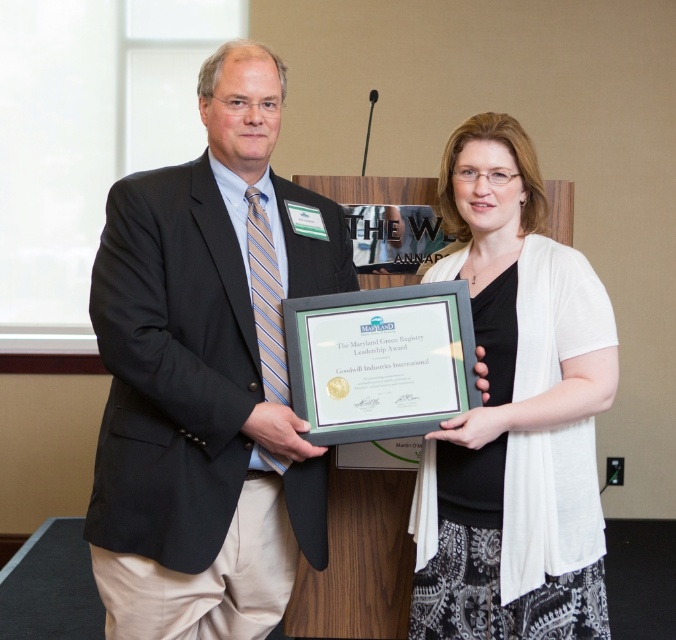
You are a photographer setting up for a group photo. You notice the matte black suit at center and the white textured cardigan at center. Which clothing item takes up more horizontal space in the frame?

The matte black suit at center takes up more horizontal space than the white textured cardigan at center because its width surpasses the cardigan.

You are a photographer standing 6 feet away from the matte black suit at center. You want to take a photo of the two people holding the certificate. Is the distance between them sufficient to fit both in the frame if your camera has a 5.5 feet focal length?

The two individuals are 5.40 feet apart, which is less than the camera focal length of 5.5 feet. Therefore, the distance between them is sufficient to fit both in the frame.

You are a photographer taking a picture of two people holding a certificate. You want to focus on the matte black suit at center and the white textured cardigan at center. Which one should you adjust your camera focus to first if you want to ensure both are in focus?

The matte black suit at center is closer to the viewer than the white textured cardigan at center, so you should focus on the matte black suit at center first to ensure both are in focus.